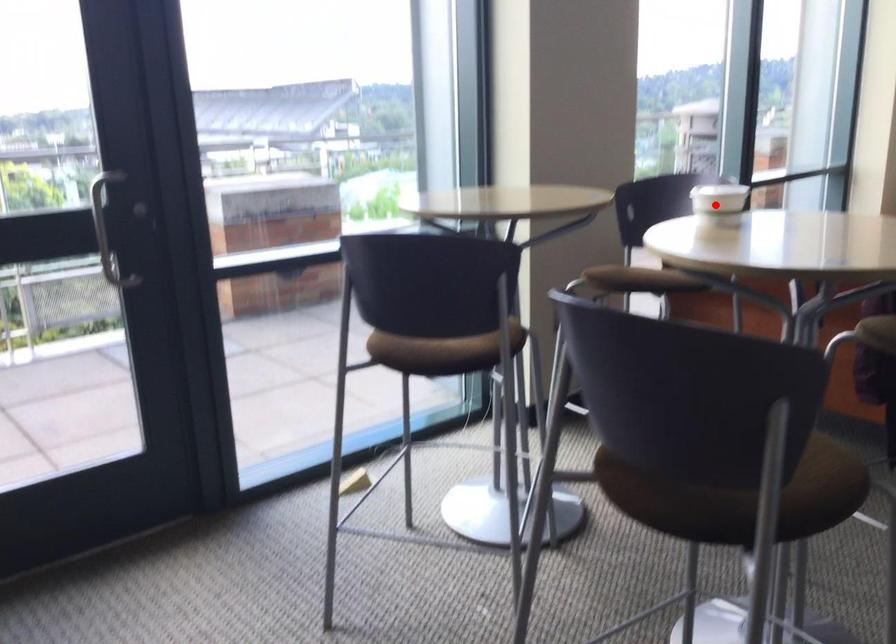
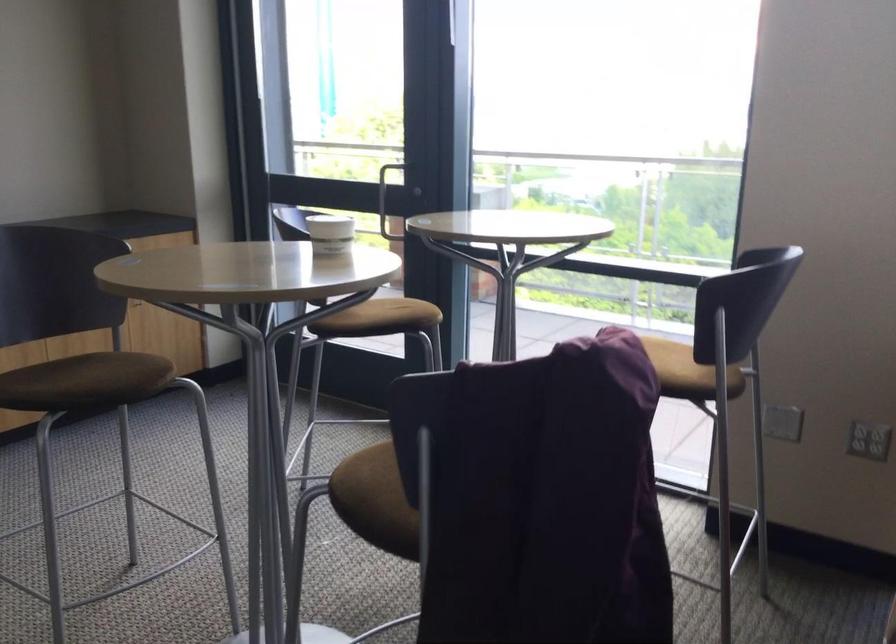
In the second image, find the point that corresponds to the highlighted location in the first image.

(330, 234)